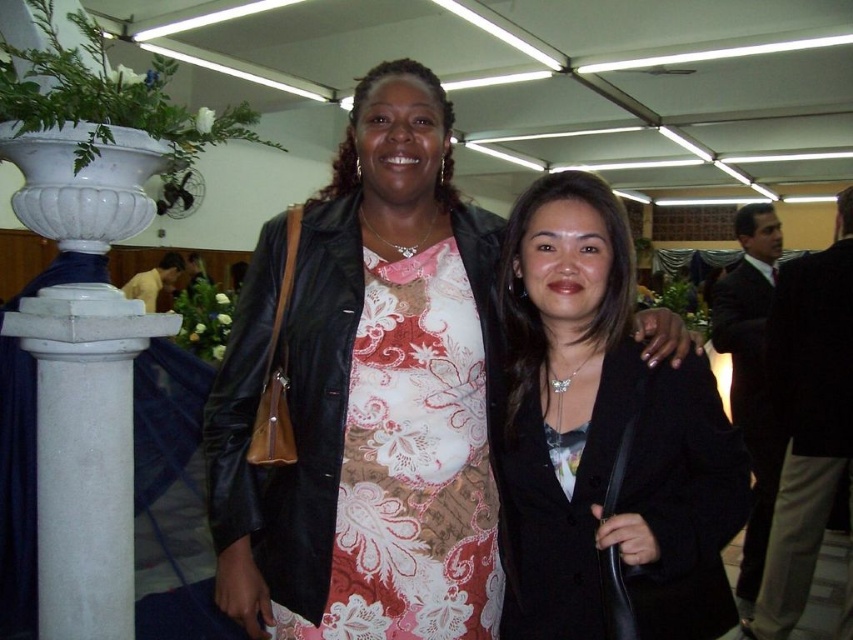
You are an AI analyzing the image. The coordinates are given in a normalized format between 0 and 1. The person on the right is wearing a dark blazer. Where is the matte black leather jacket at center located in the image?

The matte black leather jacket at center is located at the coordinates point [366,396].